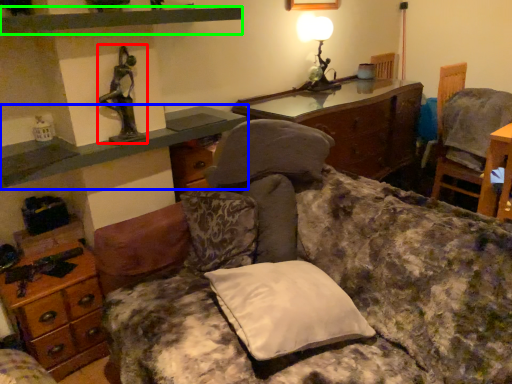
Question: Estimate the real-world distances between objects in this image. Which object is farther from person (highlighted by a red box), cabinetry (highlighted by a blue box) or shelf (highlighted by a green box)?

Choices:
 (A) cabinetry
 (B) shelf

Answer: (B)